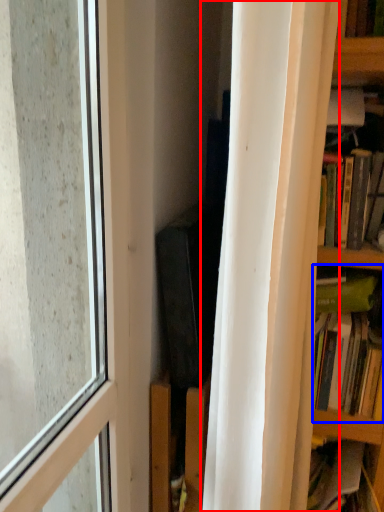
Question: Among these objects, which one is farthest to the camera, curtain (highlighted by a red box) or book (highlighted by a blue box)?

Choices:
 (A) curtain
 (B) book

Answer: (B)